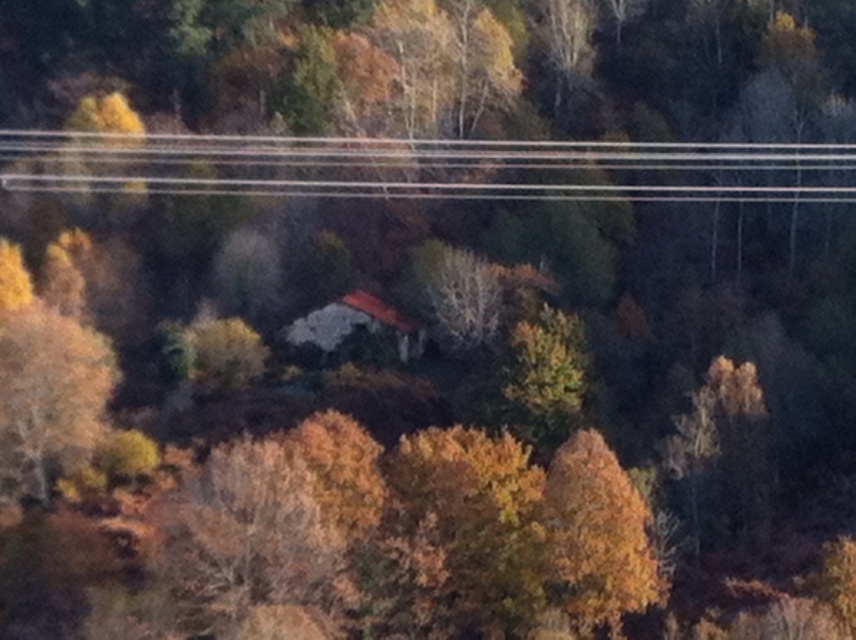
Question: Is clear plastic power lines at upper center above golden textured tree at left?

Choices:
 (A) yes
 (B) no

Answer: (A)

Question: Which point appears farthest from the camera in this image?

Choices:
 (A) (93, 364)
 (B) (813, 150)

Answer: (B)

Question: Does clear plastic power lines at upper center have a lesser width compared to golden textured tree at left?

Choices:
 (A) no
 (B) yes

Answer: (A)

Question: Is clear plastic power lines at upper center positioned behind golden textured tree at left?

Choices:
 (A) yes
 (B) no

Answer: (A)